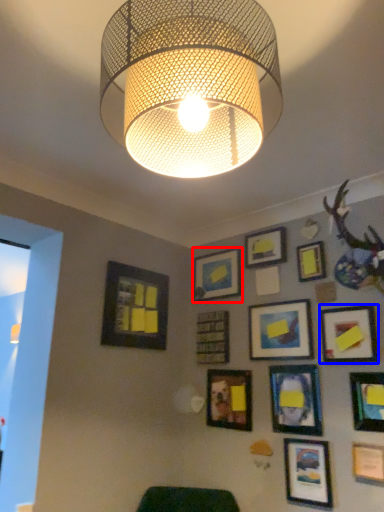
Question: Which of the following is the farthest to the observer, picture frame (highlighted by a red box) or picture frame (highlighted by a blue box)?

Choices:
 (A) picture frame
 (B) picture frame

Answer: (A)